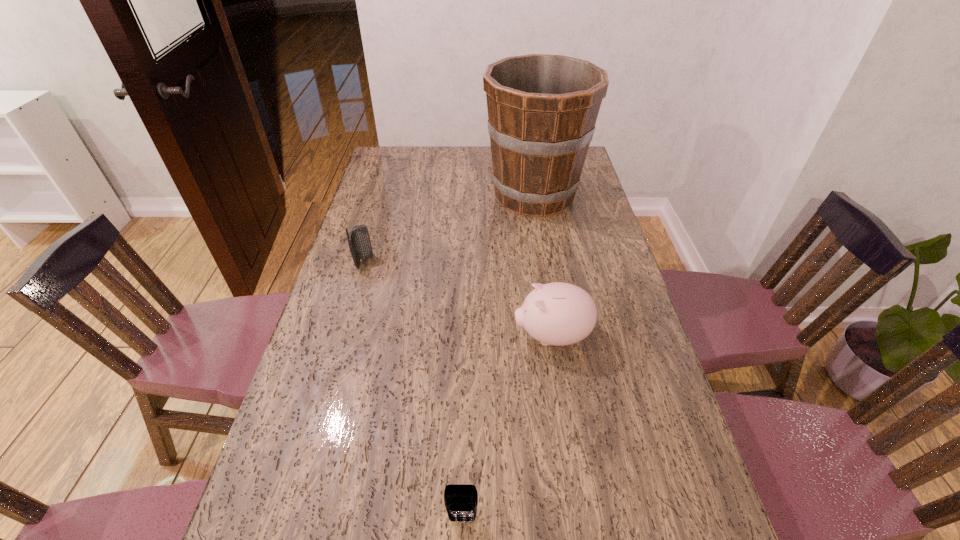
I want to click on free space located 0.250m at the snout of the piggy bank, so [x=420, y=336].

What are the coordinates of `vacant space situated on the keyboard of the farther cellular telephone` in the screenshot? It's located at (491, 262).

Locate an element on the screen. object that is at the far edge is located at coordinates (542, 109).

This screenshot has height=540, width=960. I want to click on object that is at the left edge, so click(x=359, y=242).

Where is `bucket that is at the right edge`? Image resolution: width=960 pixels, height=540 pixels. bucket that is at the right edge is located at coordinates (542, 109).

Where is `piggy bank at the right edge`? The image size is (960, 540). piggy bank at the right edge is located at coordinates (559, 314).

Locate an element on the screen. object at the far right corner is located at coordinates (542, 109).

You are a GUI agent. You are given a task and a screenshot of the screen. Output one action in this format:
    pyautogui.click(x=<x>, y=<y>)
    Task: Click on the free space at the far edge of the desktop
    
    Given the screenshot: What is the action you would take?
    pyautogui.click(x=420, y=150)

Locate an element on the screen. Image resolution: width=960 pixels, height=540 pixels. vacant region at the left edge is located at coordinates (378, 308).

Find the location of a particular element. This screenshot has height=540, width=960. free space at the right edge of the desktop is located at coordinates (608, 228).